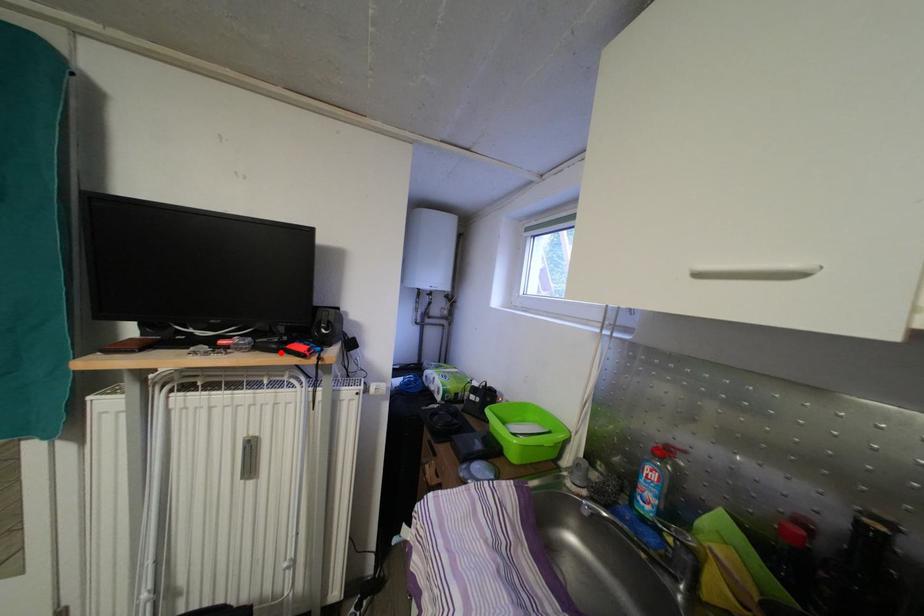
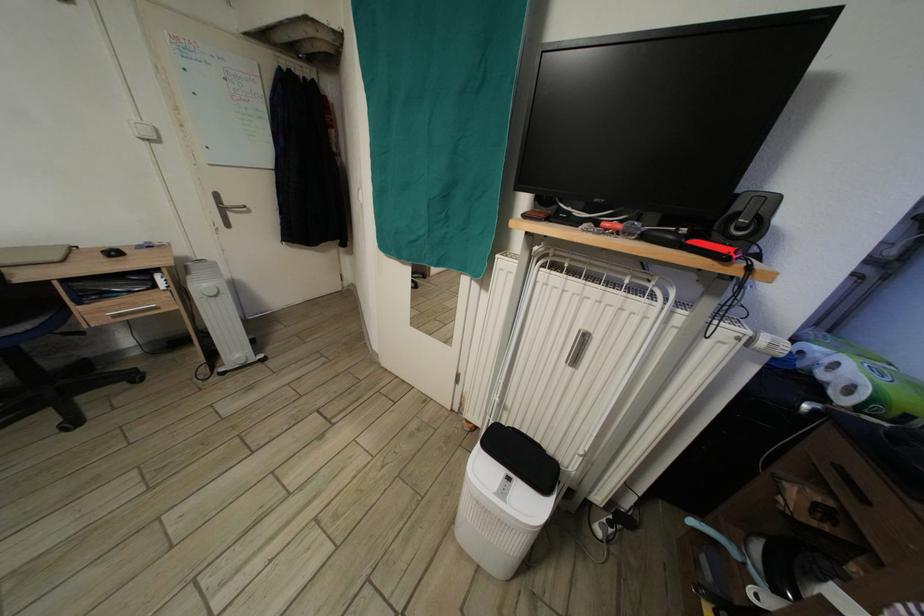
In the second image, find the point that corresponds to the highlighted location in the first image.

(675, 245)